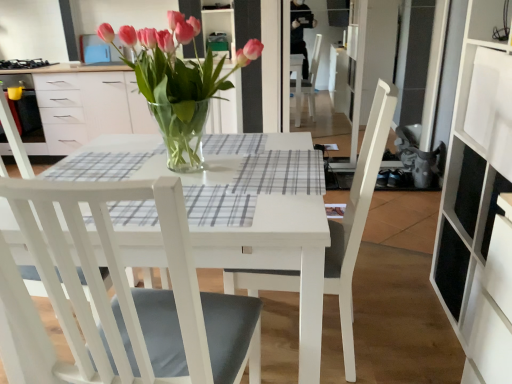
This screenshot has height=384, width=512. Identify the location of free spot above gray checkered placemat at center (from a real-world perspective). (283, 163).